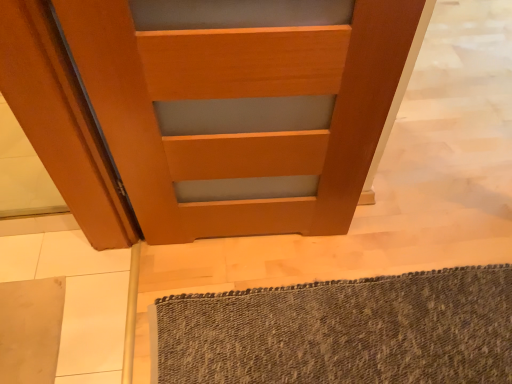
Question: Is textured gray bath mat at lower right smaller than wooden door at center?

Choices:
 (A) no
 (B) yes

Answer: (B)

Question: Is textured gray bath mat at lower right turned away from wooden door at center?

Choices:
 (A) no
 (B) yes

Answer: (A)

Question: Would you say textured gray bath mat at lower right is a long distance from wooden door at center?

Choices:
 (A) no
 (B) yes

Answer: (A)

Question: Is textured gray bath mat at lower right in front of wooden door at center?

Choices:
 (A) yes
 (B) no

Answer: (B)

Question: Could wooden door at center be considered to be inside textured gray bath mat at lower right?

Choices:
 (A) yes
 (B) no

Answer: (B)

Question: Are textured gray bath mat at lower right and wooden door at center beside each other?

Choices:
 (A) no
 (B) yes

Answer: (A)

Question: Is wooden door at center in front of textured gray bath mat at lower right?

Choices:
 (A) no
 (B) yes

Answer: (B)

Question: Is wooden door at center looking in the opposite direction of textured gray bath mat at lower right?

Choices:
 (A) no
 (B) yes

Answer: (A)

Question: Is wooden door at center positioned behind textured gray bath mat at lower right?

Choices:
 (A) yes
 (B) no

Answer: (B)

Question: Considering the relative positions of wooden door at center and textured gray bath mat at lower right in the image provided, is wooden door at center to the right of textured gray bath mat at lower right from the viewer's perspective?

Choices:
 (A) yes
 (B) no

Answer: (B)

Question: From the image's perspective, would you say wooden door at center is positioned over textured gray bath mat at lower right?

Choices:
 (A) no
 (B) yes

Answer: (B)

Question: Does wooden door at center have a smaller size compared to textured gray bath mat at lower right?

Choices:
 (A) no
 (B) yes

Answer: (A)

Question: From the image's perspective, is wooden door at center positioned above or below textured gray bath mat at lower right?

Choices:
 (A) above
 (B) below

Answer: (A)